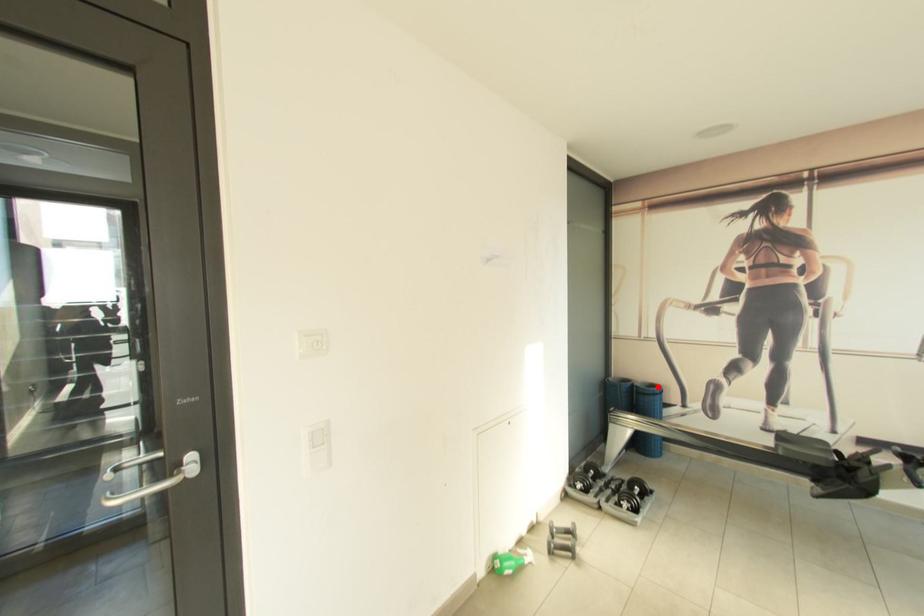
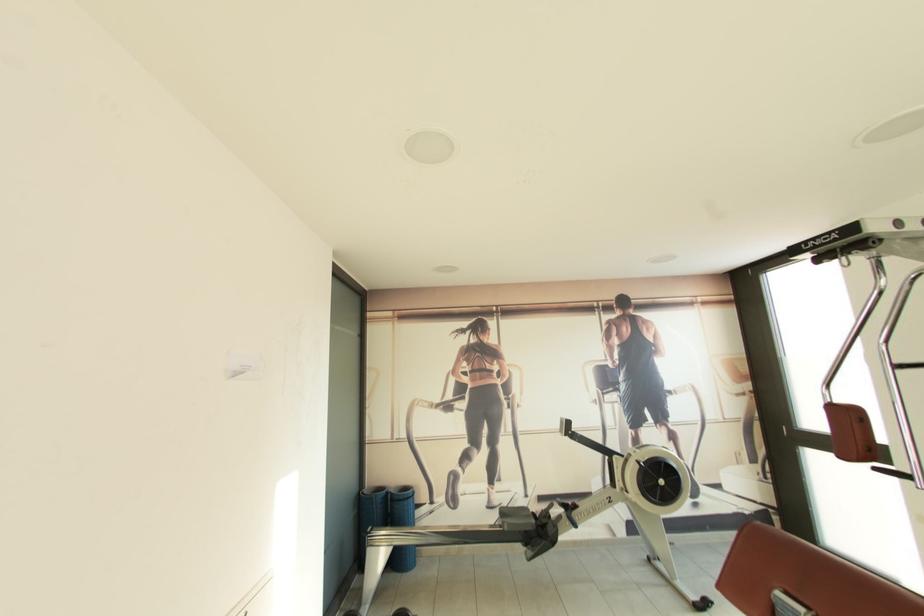
Question: I am providing you with two images of the same scene from different viewpoints. A red point is shown in image1. For the corresponding object point in image2, is it positioned nearer or farther from the camera?

Choices:
 (A) Nearer
 (B) Farther

Answer: (B)